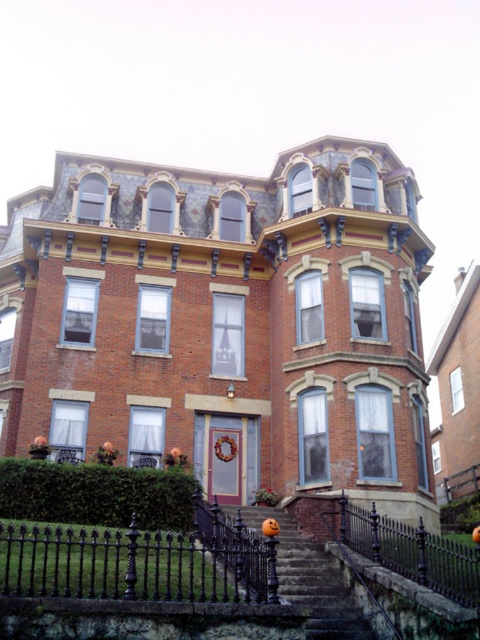
You are standing in front of the Victorian brick house. You notice a point marked at coordinates (96,493). Based on the scene description, what is located at that point?

The point at coordinates (96,493) corresponds to the green leafy hedge at lower left.

You are standing at the base of the smooth stone stairs at center and want to reach the front door of the Victorian house. Which direction should you look to see the green leafy hedge at lower left?

The green leafy hedge at lower left is above the smooth stone stairs at center, so you should look upward to see the green leafy hedge at lower left.

You are standing in front of the Victorian house and want to walk from the green leafy hedge at lower left to the black wrought iron fence at lower right. Which direction should you move relative to the hedge?

The black wrought iron fence at lower right is behind the green leafy hedge at lower left, so you should move backward away from the house to reach it.